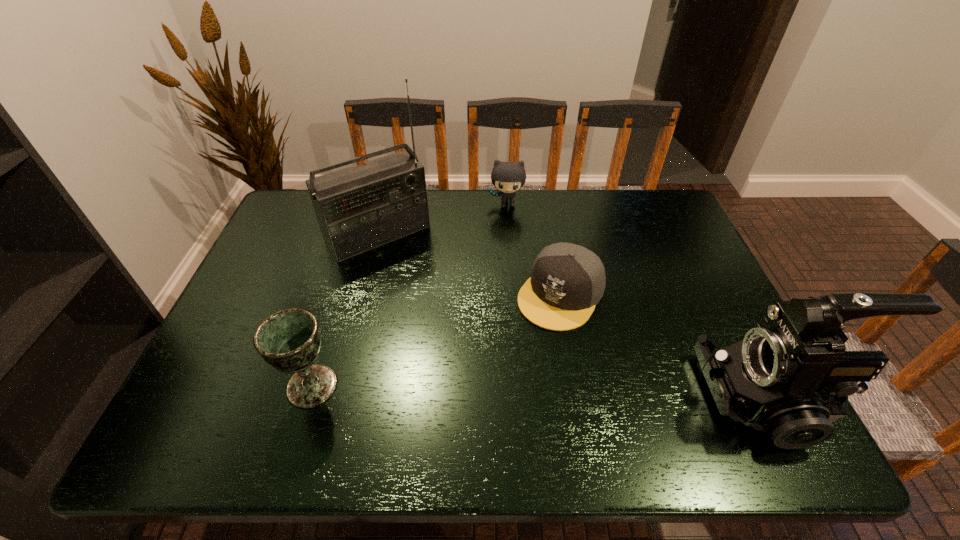
I want to click on vacant area that lies between the cap and the fourth shortest object, so click(664, 346).

I want to click on vacant space that's between the tallest object and the cap, so click(469, 264).

At what (x,y) coordinates should I click in order to perform the action: click on vacant area between the cap and the kitten. Please return your answer as a coordinate pair (x, y). This screenshot has width=960, height=540. Looking at the image, I should click on (534, 249).

Find the location of a particular element. The width and height of the screenshot is (960, 540). free space between the cap and the camcorder is located at coordinates (664, 346).

I want to click on blank region between the chalice and the camcorder, so click(x=540, y=392).

I want to click on vacant space in between the tallest object and the kitten, so click(x=443, y=219).

Locate an element on the screen. vacant region between the tallest object and the shortest object is located at coordinates (469, 264).

Find the location of `vacant space that's between the shortest object and the radio receiver`. vacant space that's between the shortest object and the radio receiver is located at coordinates (469, 264).

Identify the location of vacant area that lies between the shortest object and the kitten. (534, 249).

The width and height of the screenshot is (960, 540). What are the coordinates of `the closest object to the rightmost object` in the screenshot? It's located at (567, 281).